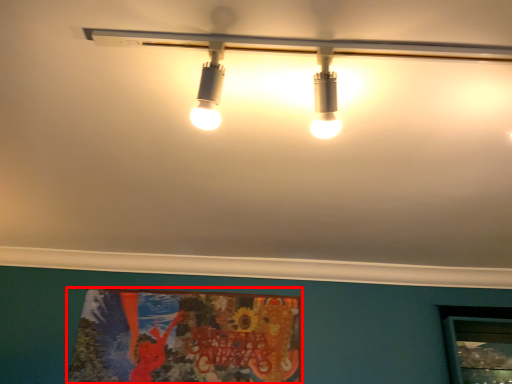
Question: From the image's perspective, what is the correct spatial positioning of poster page (annotated by the red box) in reference to lamp?

Choices:
 (A) below
 (B) above

Answer: (A)